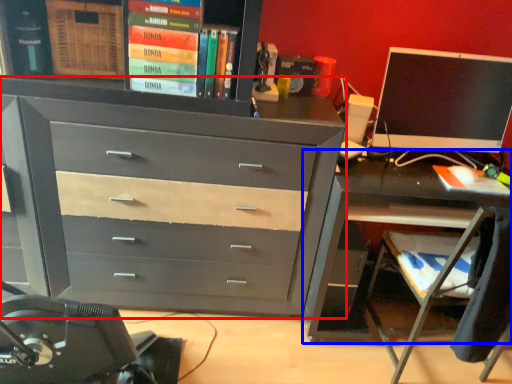
Question: Which object is closer to the camera taking this photo, chest of drawers (highlighted by a red box) or desk (highlighted by a blue box)?

Choices:
 (A) chest of drawers
 (B) desk

Answer: (A)